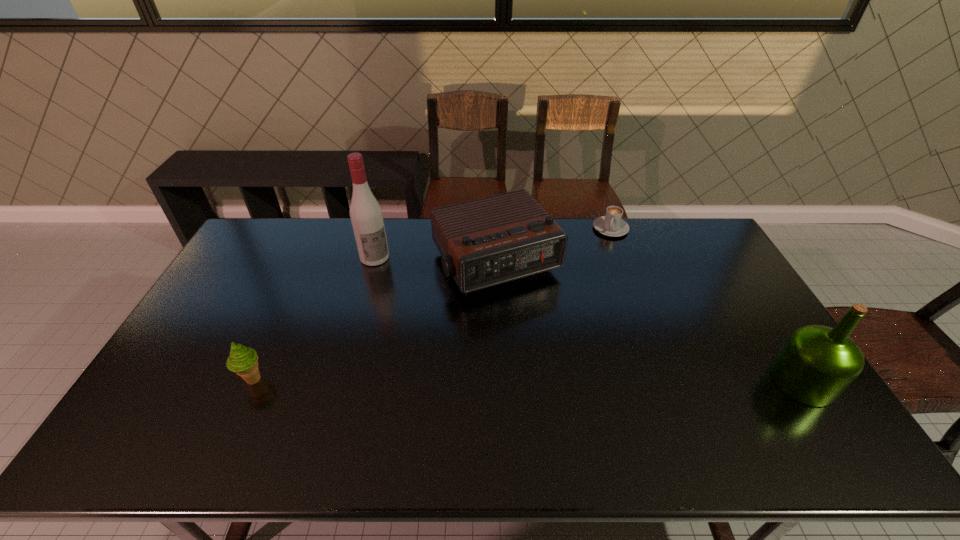
Locate an element on the screen. free space on the desktop that is between the second shortest object and the olive oil and is positioned on the label of the tallest object is located at coordinates (452, 380).

Where is `vacant space on the desktop that is between the icecream and the rightmost object and is positioned on the front panel of the third object from left to right`? The height and width of the screenshot is (540, 960). vacant space on the desktop that is between the icecream and the rightmost object and is positioned on the front panel of the third object from left to right is located at coordinates (576, 381).

At what (x,y) coordinates should I click in order to perform the action: click on free space on the desktop that is between the fourth tallest object and the rightmost object and is positioned to the right of the cappuccino. Please return your answer as a coordinate pair (x, y). Looking at the image, I should click on (563, 381).